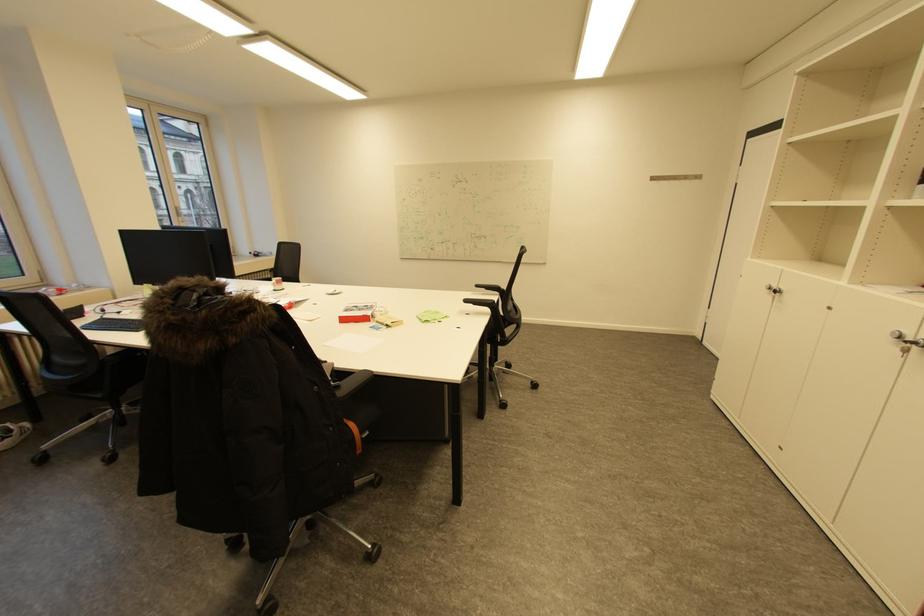
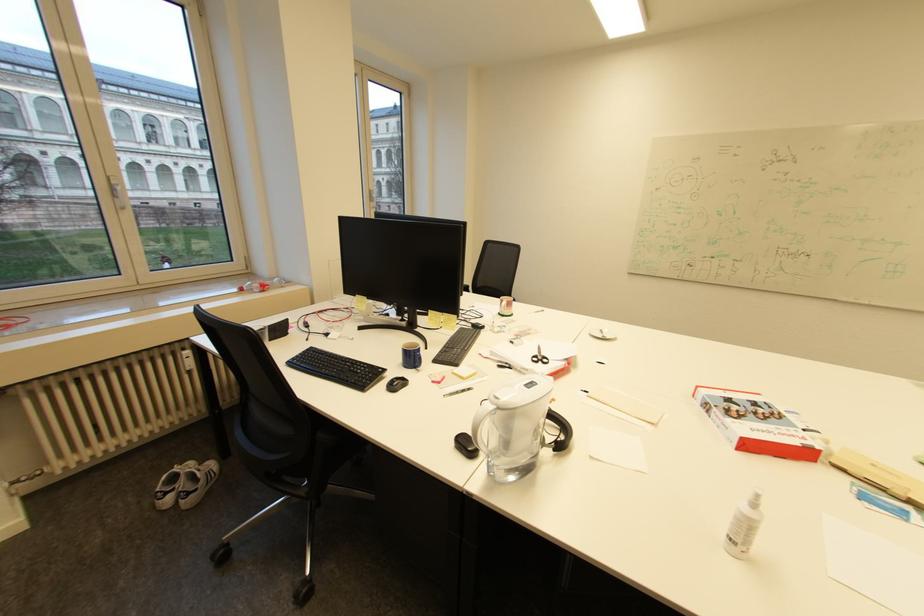
Which direction would the cameraman need to move to produce the second image?

The cameraman walked toward left, forward.